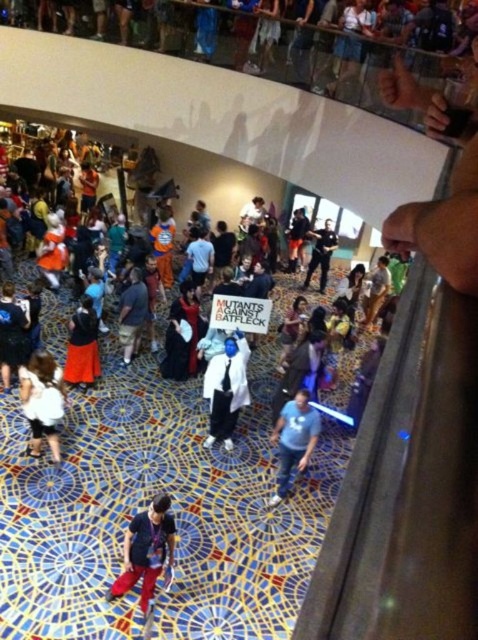
Between dark blue fabric shirt at center and matte black suit at center, which one is positioned lower?

dark blue fabric shirt at center

Where is `dark blue fabric shirt at center`? This screenshot has height=640, width=478. dark blue fabric shirt at center is located at coordinates (131, 312).

Which is below, white matte shirt at lower left or velvet black cape at lower left?

Positioned lower is white matte shirt at lower left.

Who is more distant from viewer, [53,420] or [76,380]?

The point [76,380] is behind.

Identify the location of white matte shirt at lower left. The width and height of the screenshot is (478, 640). (43, 401).

Is the position of blue cotton shirt at center more distant than that of velvet black cape at lower left?

No, it is in front of velvet black cape at lower left.

Can you confirm if blue cotton shirt at center is wider than velvet black cape at lower left?

Indeed, blue cotton shirt at center has a greater width compared to velvet black cape at lower left.

Does point (302, 426) come in front of point (66, 378)?

Yes, point (302, 426) is in front of point (66, 378).

Locate an element on the screen. blue cotton shirt at center is located at coordinates (293, 440).